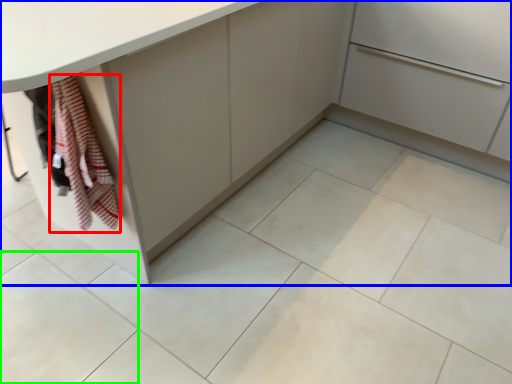
Question: Which object is the closest to the blanket (highlighted by a red box)? Choose among these: cabinetry (highlighted by a blue box) or ceramic tile (highlighted by a green box).

Choices:
 (A) cabinetry
 (B) ceramic tile

Answer: (B)